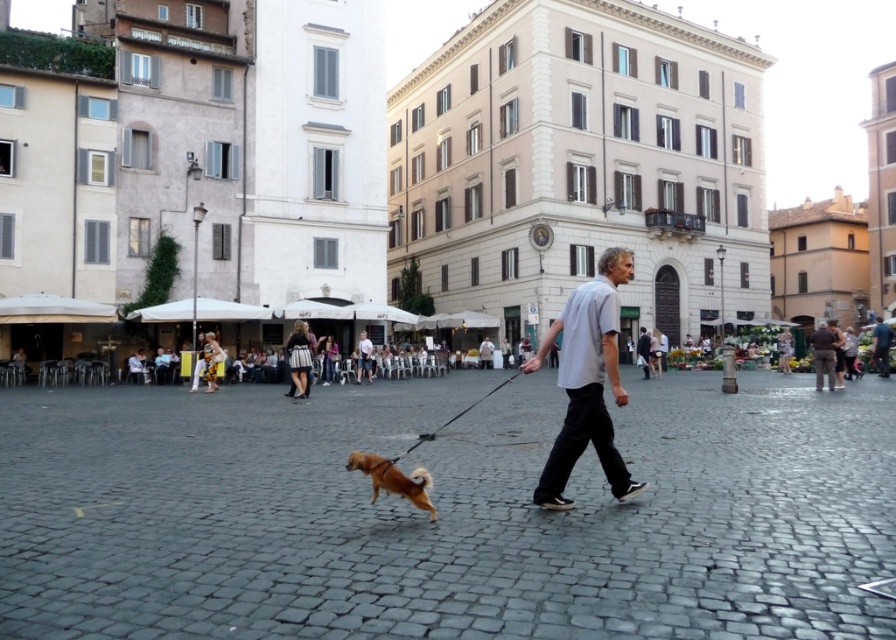
You are standing at the center of the urban square and want to find the golden fur dog at center. According to the coordinates given, in which direction should you look to find it?

The golden fur dog at center is located at coordinates [393,480]. Since you are at the center of the square, which would be coordinate [448,320], you should look towards the northeast direction to find the golden fur dog at center.

You are a photographer standing in the urban square. You want to take a photo of the golden fur dog at center and the light gray cotton shirt at center. Which object should you focus on first to ensure both are in focus?

The golden fur dog at center is closer to the viewer than the light gray cotton shirt at center, so you should focus on the golden fur dog at center first to ensure both are in focus.